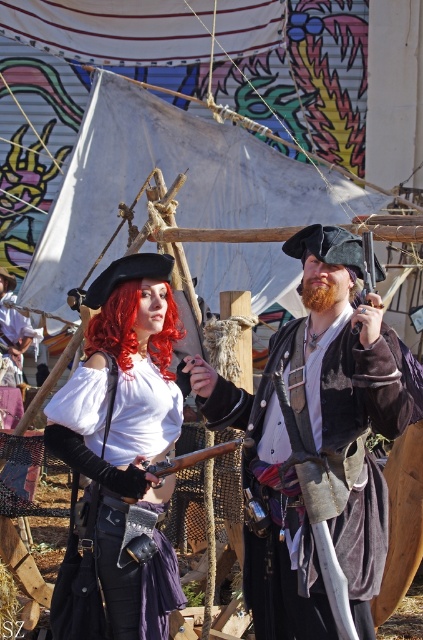
Does curly red hair at center have a greater width compared to wooden smooth gun at center?

No.

Is curly red hair at center shorter than wooden smooth gun at center?

Incorrect, curly red hair at center's height does not fall short of wooden smooth gun at center's.

Does point (123, 314) come closer to viewer compared to point (154, 474)?

No, it is not.

At what (x,y) coordinates should I click in order to perform the action: click on curly red hair at center. Please return your answer as a coordinate pair (x, y). This screenshot has width=423, height=640. Looking at the image, I should click on (117, 324).

Can you confirm if matte white blouse at center is positioned to the left of curly red hair at center?

In fact, matte white blouse at center is to the right of curly red hair at center.

Can you confirm if matte white blouse at center is taller than curly red hair at center?

Yes.

Between point (99, 472) and point (109, 314), which one is positioned in front?

Positioned in front is point (99, 472).

Locate an element on the screen. matte white blouse at center is located at coordinates (126, 436).

Which of these two, brown leather sword at center or wooden sword at center, stands shorter?

wooden sword at center is shorter.

Is brown leather sword at center positioned at the back of wooden sword at center?

No, brown leather sword at center is in front of wooden sword at center.

Who is more forward, (365, 577) or (368, 284)?

Point (365, 577)

The height and width of the screenshot is (640, 423). What are the coordinates of `brown leather sword at center` in the screenshot? It's located at (307, 422).